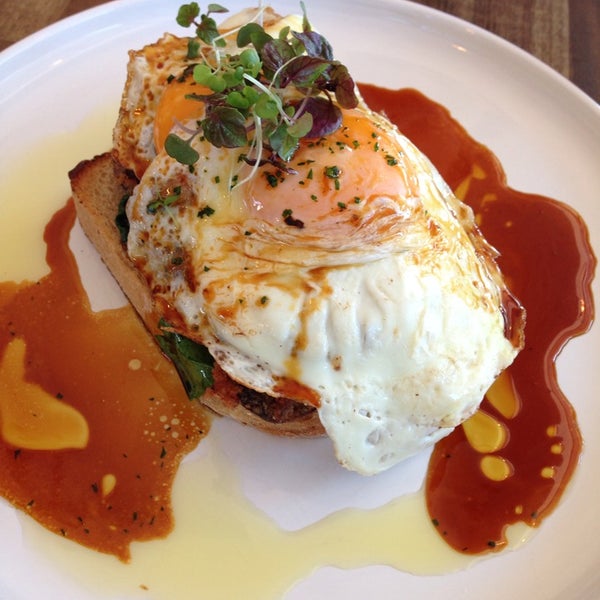
At what (x,y) coordinates should I click in order to perform the action: click on table. Please return your answer as a coordinate pair (x, y). This screenshot has width=600, height=600. Looking at the image, I should click on (556, 22).